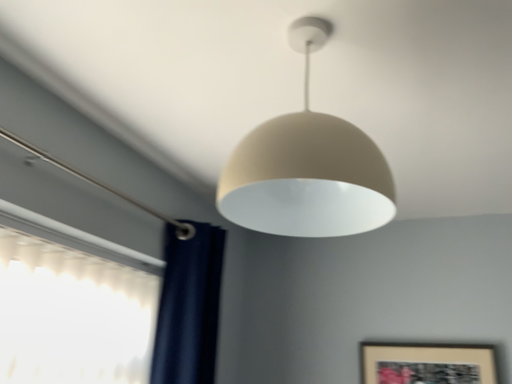
Question: Is point (380, 352) closer or farther from the camera than point (354, 205)?

Choices:
 (A) farther
 (B) closer

Answer: (A)

Question: From the image's perspective, is wooden framed artwork at lower right positioned above or below matte beige lampshade at center?

Choices:
 (A) above
 (B) below

Answer: (B)

Question: Relative to matte beige lampshade at center, is wooden framed artwork at lower right in front or behind?

Choices:
 (A) behind
 (B) front

Answer: (A)

Question: Would you say matte beige lampshade at center is inside or outside wooden framed artwork at lower right?

Choices:
 (A) inside
 (B) outside

Answer: (B)

Question: In the image, is matte beige lampshade at center on the left side or the right side of wooden framed artwork at lower right?

Choices:
 (A) right
 (B) left

Answer: (B)

Question: Is point (309, 41) positioned closer to the camera than point (396, 360)?

Choices:
 (A) farther
 (B) closer

Answer: (B)

Question: From the image's perspective, is matte beige lampshade at center above or below wooden framed artwork at lower right?

Choices:
 (A) above
 (B) below

Answer: (A)